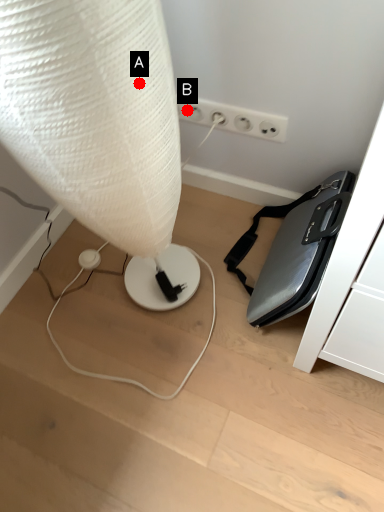
Question: Two points are circled on the image, labeled by A and B beside each circle. Which of the following is the closest to the observer?

Choices:
 (A) A is closer
 (B) B is closer

Answer: (A)